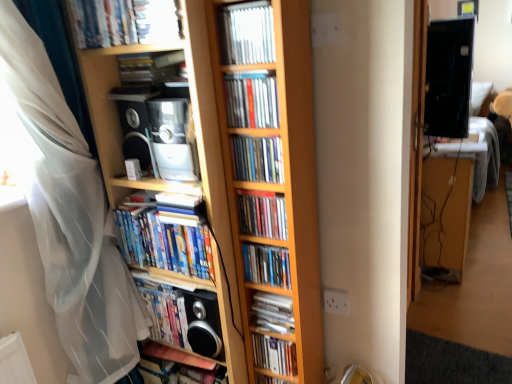
Question: Considering the positions of point pyautogui.click(x=208, y=236) and point pyautogui.click(x=33, y=205), is point pyautogui.click(x=208, y=236) closer or farther from the camera than point pyautogui.click(x=33, y=205)?

Choices:
 (A) closer
 (B) farther

Answer: (A)

Question: From a real-world perspective, is hardcover books at center, the 6th book positioned from the top, physically located above or below white sheer curtain at left?

Choices:
 (A) above
 (B) below

Answer: (B)

Question: Which object is the farthest from the matte plastic dvds at center, the 8th book viewed from the top?

Choices:
 (A) matte plastic book at upper left, the 1th book from the top
 (B) matte plastic book at center, which appears as the ninth book when ordered from the bottom
 (C) wooden desk at right
 (D) metallic silver cd at center, the 10th book in the bottom-to-top sequence
 (E) hardcover book at lower left, the 11th book when ordered from top to bottom

Answer: (C)

Question: Considering the real-world distances, which object is closest to the wooden bookcase at center?

Choices:
 (A) matte plastic books at center, the seventh book ordered from the bottom
 (B) matte plastic book at center, which appears as the ninth book when ordered from the bottom
 (C) black glossy monitor at upper right
 (D) metallic silver cd at center, the 10th book in the bottom-to-top sequence
 (E) hardcover book at lower left, the 11th book when ordered from top to bottom

Answer: (A)